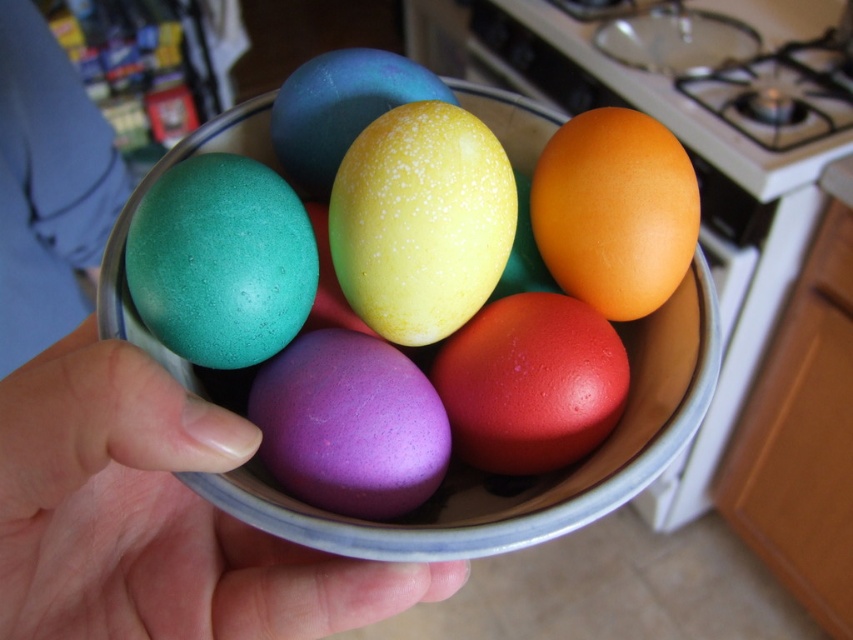
Who is positioned more to the left, orange matte egg at center or matte red egg at center?

matte red egg at center

Which of these two, orange matte egg at center or matte red egg at center, stands taller?

Standing taller between the two is orange matte egg at center.

This screenshot has width=853, height=640. Find the location of `orange matte egg at center`. orange matte egg at center is located at coordinates (614, 211).

Where is `orange matte egg at center`? The width and height of the screenshot is (853, 640). orange matte egg at center is located at coordinates (614, 211).

Where is `nail polish at lower center`? The width and height of the screenshot is (853, 640). nail polish at lower center is located at coordinates (155, 516).

Looking at this image, measure the distance between nail polish at lower center and matte red egg at center.

nail polish at lower center is 6.50 inches away from matte red egg at center.

Describe the element at coordinates (155, 516) in the screenshot. I see `nail polish at lower center` at that location.

Find the location of a particular element. This screenshot has height=640, width=853. nail polish at lower center is located at coordinates (x=155, y=516).

Who is positioned more to the right, matte teal egg at center-left or orange matte egg at center?

orange matte egg at center

Is matte teal egg at center-left bigger than orange matte egg at center?

No.

What do you see at coordinates (221, 260) in the screenshot? The image size is (853, 640). I see `matte teal egg at center-left` at bounding box center [221, 260].

The width and height of the screenshot is (853, 640). Find the location of `matte teal egg at center-left`. matte teal egg at center-left is located at coordinates (221, 260).